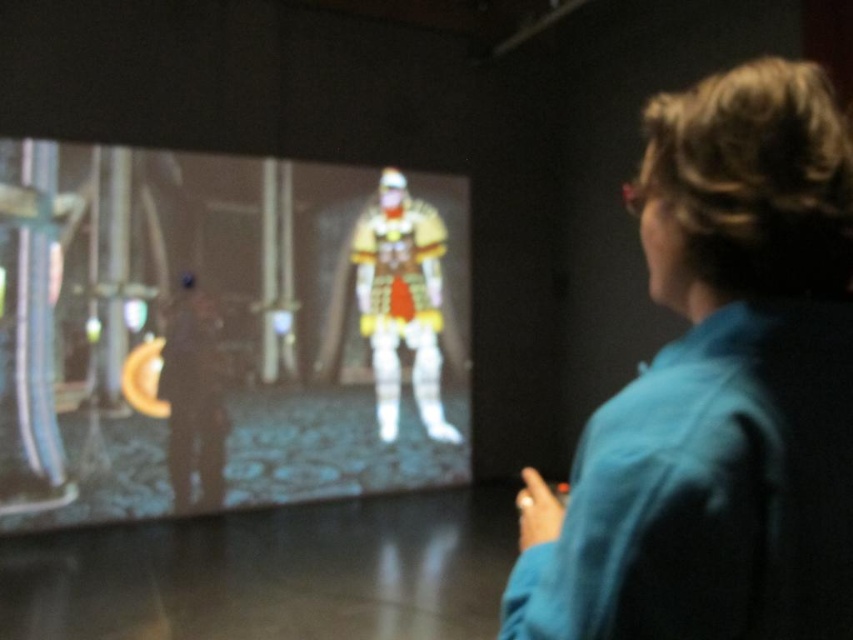
Can you confirm if matte plastic figure at center is taller than white glossy armor at center?

Yes.

Is matte plastic figure at center shorter than white glossy armor at center?

No, matte plastic figure at center is not shorter than white glossy armor at center.

The image size is (853, 640). I want to click on matte plastic figure at center, so click(x=223, y=332).

The image size is (853, 640). I want to click on matte plastic figure at center, so click(x=223, y=332).

Which is above, matte plastic figure at center or blue fabric at upper right?

blue fabric at upper right is above.

Does matte plastic figure at center have a lesser height compared to blue fabric at upper right?

No, matte plastic figure at center is not shorter than blue fabric at upper right.

Locate an element on the screen. The height and width of the screenshot is (640, 853). matte plastic figure at center is located at coordinates (223, 332).

What are the coordinates of `matte plastic figure at center` in the screenshot? It's located at (223, 332).

Does point (788, 524) lie behind point (434, 323)?

No, (788, 524) is in front of (434, 323).

Which is below, blue fabric at upper right or white glossy armor at center?

blue fabric at upper right is below.

Is point (732, 179) behind point (363, 250)?

No, it is in front of (363, 250).

The height and width of the screenshot is (640, 853). Find the location of `blue fabric at upper right`. blue fabric at upper right is located at coordinates (718, 390).